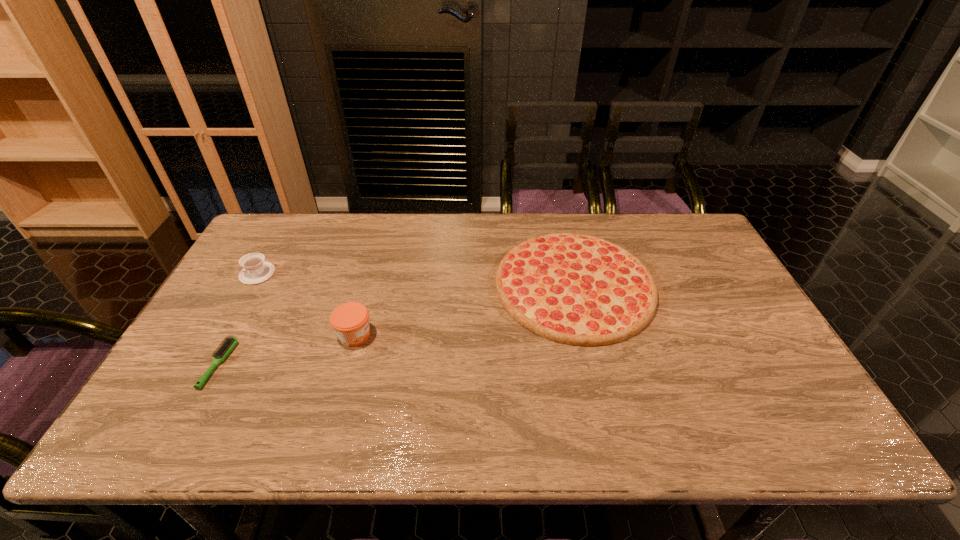
At what (x,y) coordinates should I click in order to perform the action: click on vacant area between the teacup and the hairbrush. Please return your answer as a coordinate pair (x, y). Looking at the image, I should click on (238, 319).

Where is `vacant space that is in between the teacup and the pizza`? The image size is (960, 540). vacant space that is in between the teacup and the pizza is located at coordinates tap(416, 280).

Where is `empty space that is in between the teacup and the tallest object`? This screenshot has width=960, height=540. empty space that is in between the teacup and the tallest object is located at coordinates (306, 305).

The image size is (960, 540). What are the coordinates of `free space between the teacup and the hairbrush` in the screenshot? It's located at (238, 319).

The image size is (960, 540). I want to click on empty space between the tallest object and the third shortest object, so click(306, 305).

The image size is (960, 540). I want to click on free area in between the third shortest object and the pizza, so click(x=416, y=280).

Locate which object is the closest to the teacup. Please provide its 2D coordinates. Your answer should be formatted as a tuple, i.e. [(x, y)], where the tuple contains the x and y coordinates of a point satisfying the conditions above.

[(223, 351)]

Point out which object is positioned as the third nearest to the third shortest object. Please provide its 2D coordinates. Your answer should be formatted as a tuple, i.e. [(x, y)], where the tuple contains the x and y coordinates of a point satisfying the conditions above.

[(576, 289)]

Locate an element on the screen. The width and height of the screenshot is (960, 540). vacant space that satisfies the following two spatial constraints: 1. on the back side of the hairbrush; 2. on the left side of the rightmost object is located at coordinates (262, 285).

Where is `free space that satisfies the following two spatial constraints: 1. on the back side of the hairbrush; 2. on the right side of the rightmost object`? The height and width of the screenshot is (540, 960). free space that satisfies the following two spatial constraints: 1. on the back side of the hairbrush; 2. on the right side of the rightmost object is located at coordinates 262,285.